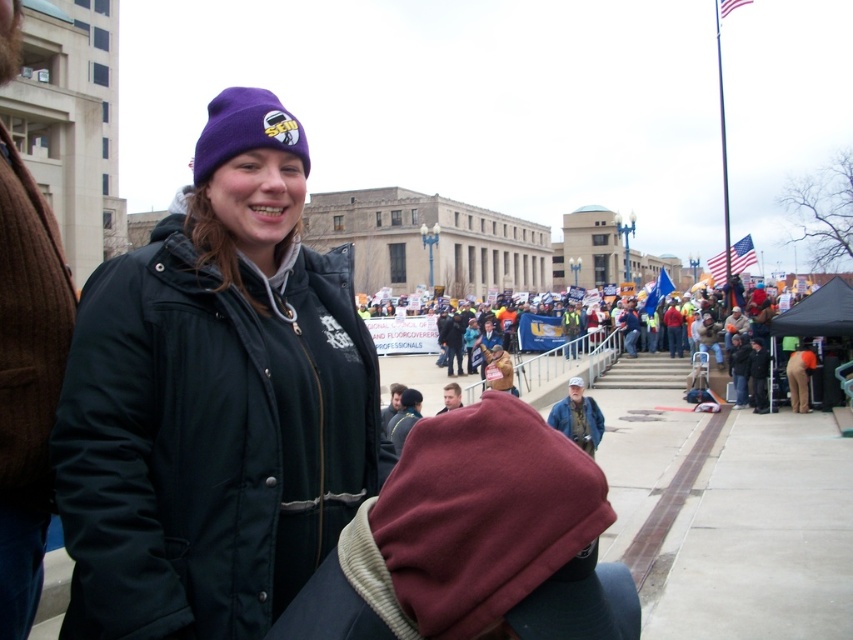
Question: Can you confirm if purple fleece beanie at upper center is smaller than yellow reflective vests at center?

Choices:
 (A) no
 (B) yes

Answer: (B)

Question: Which object is the closest to the yellow reflective vests at center?

Choices:
 (A) purple fleece beanie at upper center
 (B) matte black jacket at center

Answer: (A)

Question: Which of the following is the closest to the observer?

Choices:
 (A) (606, 346)
 (B) (200, 170)

Answer: (B)

Question: Which object is farther from the camera taking this photo?

Choices:
 (A) purple fleece beanie at upper center
 (B) yellow reflective vests at center

Answer: (B)

Question: Can you confirm if matte black jacket at center is bigger than purple fleece beanie at upper center?

Choices:
 (A) yes
 (B) no

Answer: (B)

Question: Can you confirm if matte black jacket at center is positioned below purple fleece beanie at upper center?

Choices:
 (A) no
 (B) yes

Answer: (B)